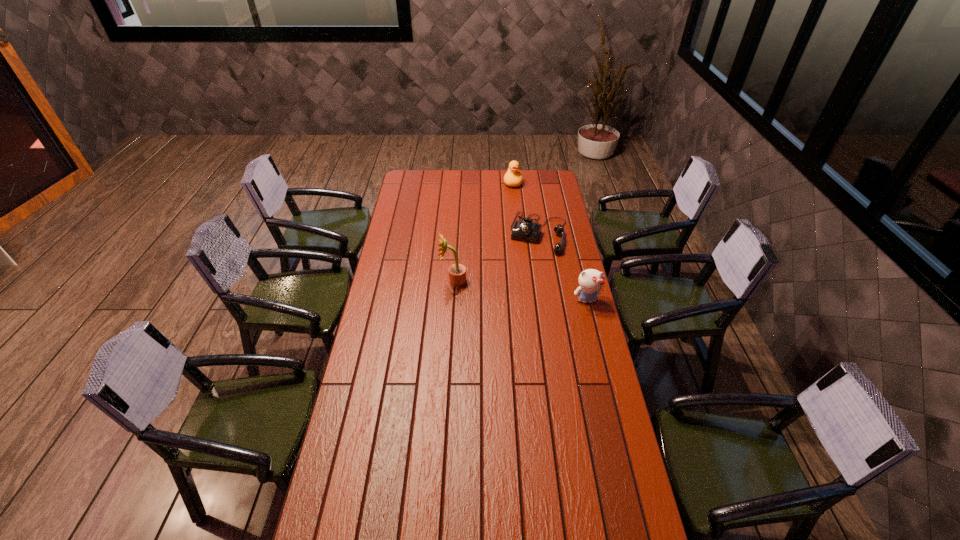
Image resolution: width=960 pixels, height=540 pixels. I want to click on the leftmost object, so click(x=457, y=272).

The image size is (960, 540). What are the coordinates of `sunflower` in the screenshot? It's located at (457, 272).

At what (x,y) coordinates should I click in order to perform the action: click on kitten. Please return your answer as a coordinate pair (x, y). Image resolution: width=960 pixels, height=540 pixels. Looking at the image, I should click on (591, 281).

Where is `the nearest object`? The image size is (960, 540). the nearest object is located at coordinates (591, 281).

Identify the location of the shortest object. The width and height of the screenshot is (960, 540). (527, 230).

This screenshot has height=540, width=960. Find the location of `the third nearest object`. the third nearest object is located at coordinates tap(527, 230).

Identify the location of the farthest object. Image resolution: width=960 pixels, height=540 pixels. (513, 178).

Locate an element on the screen. The image size is (960, 540). the second shortest object is located at coordinates (513, 178).

This screenshot has height=540, width=960. What are the coordinates of `vacant region located on the face of the leftmost object` in the screenshot? It's located at (399, 281).

Find the location of a particular element. The height and width of the screenshot is (540, 960). free region located 0.180m on the face of the leftmost object is located at coordinates (401, 281).